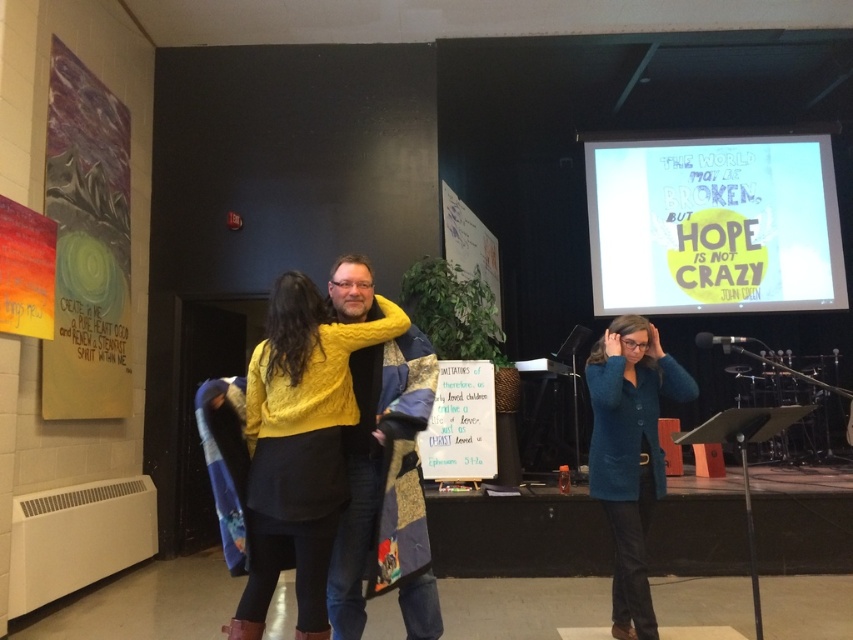
From the picture: You are attending an event in this church hall and notice two knitted items at the center of the image. Which one is physically closer to you, the knitted yellow sweater at center or the knitted yellow scarf at center?

The knitted yellow sweater at center is closer to the viewer than the knitted yellow scarf at center.

You are an event planner who needs to hang a 1.5 meter tall banner. You see the white glossy projection screen at upper right and the teal matte blazer at center. Which object would be a better choice to hang the banner on, considering their heights?

The white glossy projection screen at upper right is much taller than the teal matte blazer at center, so the banner would be better suited to be hung on the white glossy projection screen at upper right.